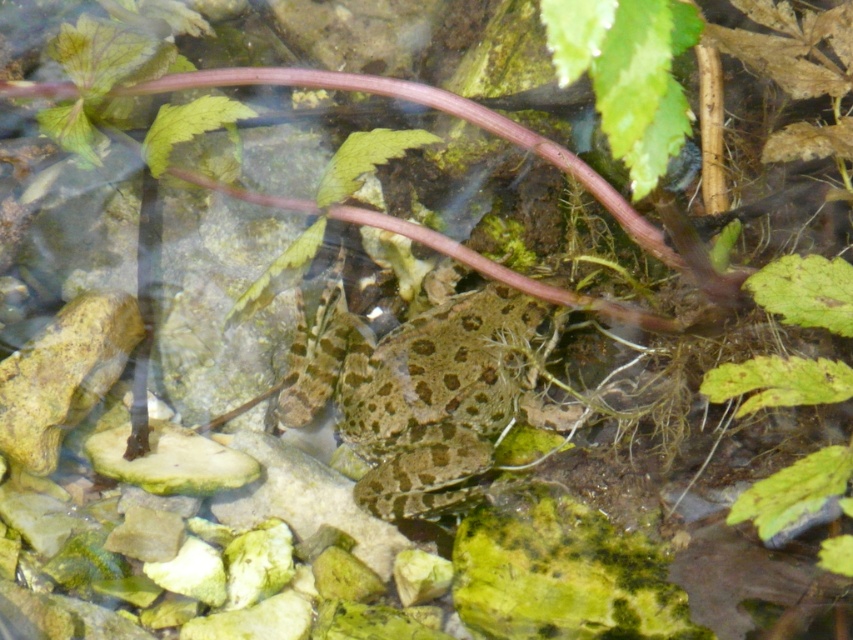
Question: Is speckled skin frog at center bigger than green leafy plant at lower right?

Choices:
 (A) no
 (B) yes

Answer: (B)

Question: Can you confirm if speckled skin frog at center is wider than green leafy plant at lower right?

Choices:
 (A) yes
 (B) no

Answer: (A)

Question: Does speckled skin frog at center appear over green leafy plant at lower right?

Choices:
 (A) yes
 (B) no

Answer: (A)

Question: Which point appears closest to the camera in this image?

Choices:
 (A) (743, 364)
 (B) (395, 481)

Answer: (A)

Question: Among these objects, which one is nearest to the camera?

Choices:
 (A) green leafy plant at lower right
 (B) speckled skin frog at center

Answer: (A)

Question: Which point is farther to the camera?

Choices:
 (A) speckled skin frog at center
 (B) green leafy plant at lower right

Answer: (A)